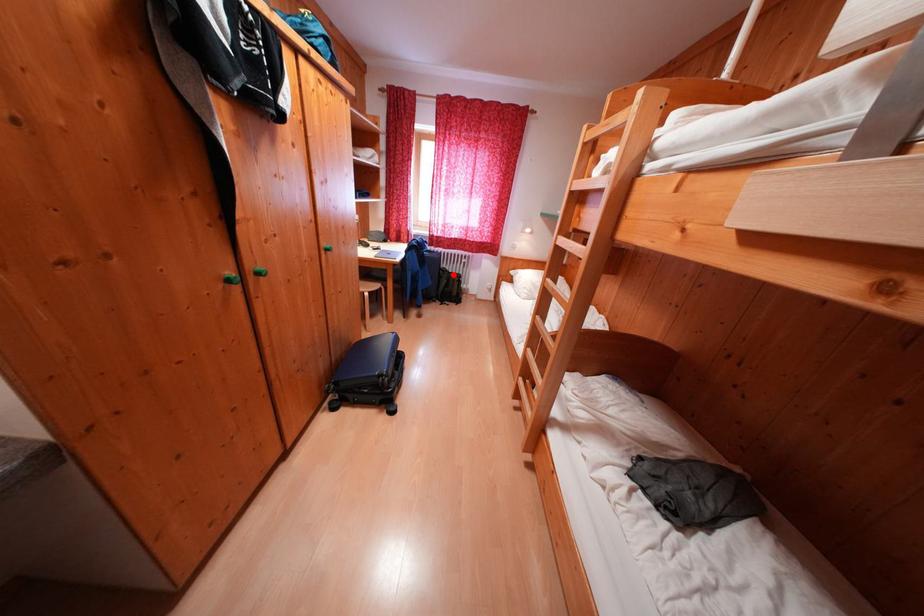
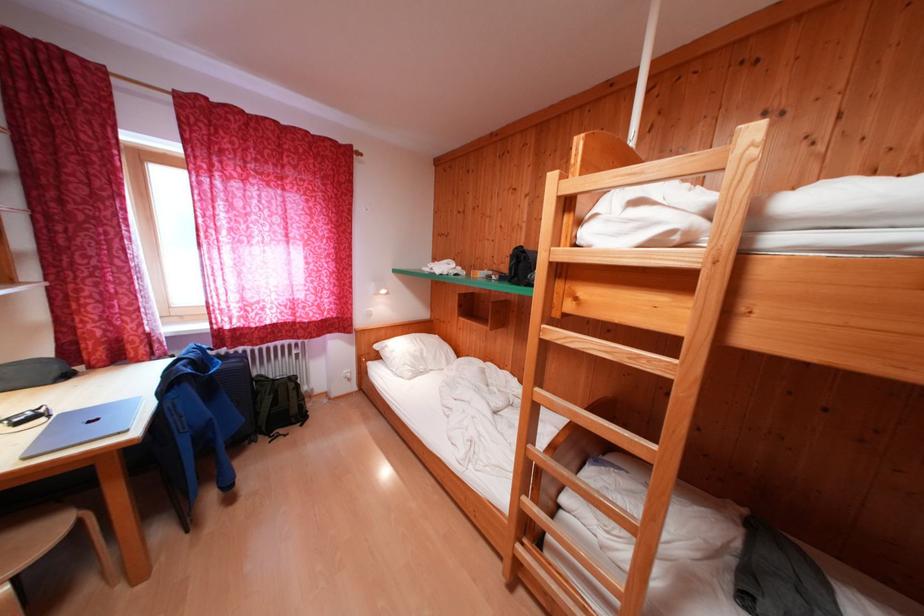
Locate, in the second image, the point that corresponds to the highlighted location in the first image.

(271, 383)